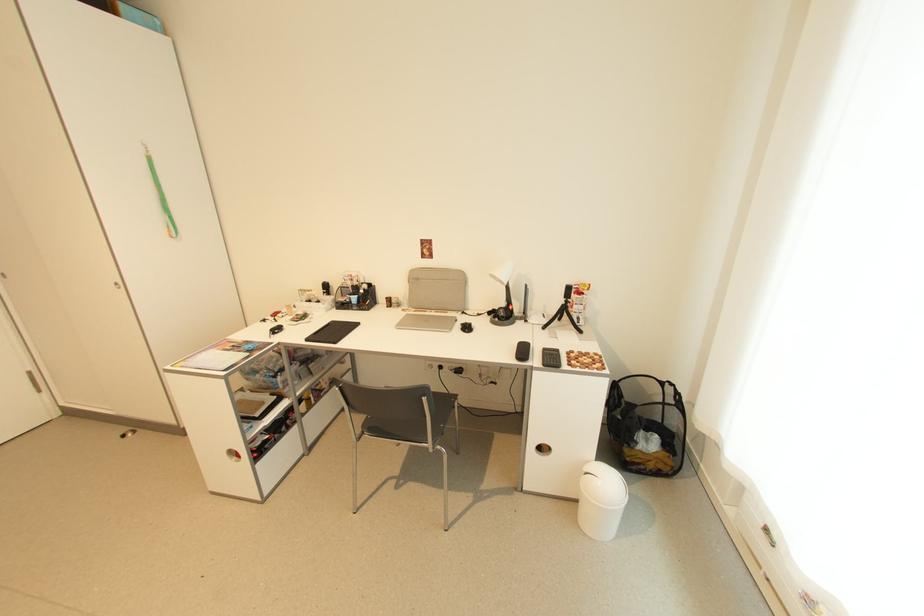
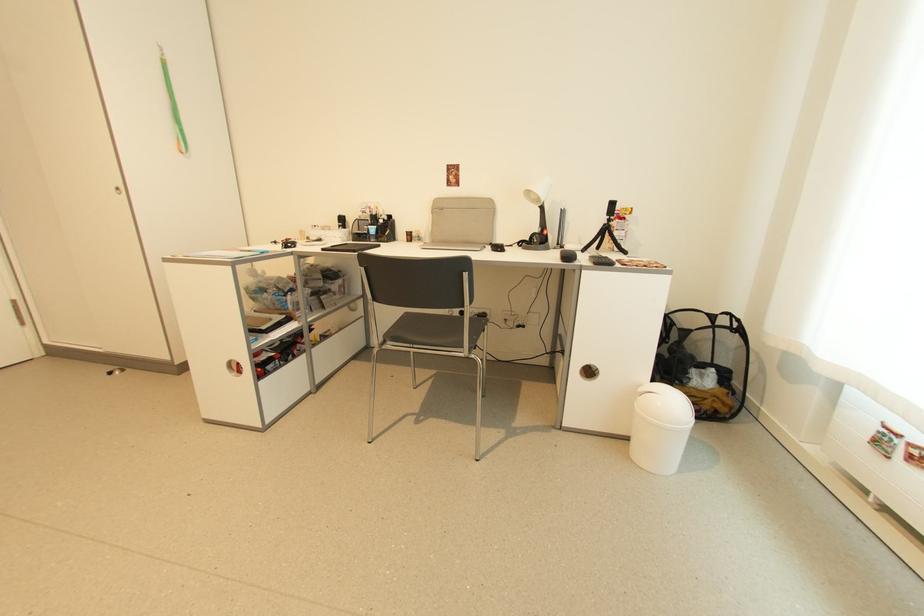
Where in the second image is the point corresponding to (548,367) from the first image?

(600, 265)